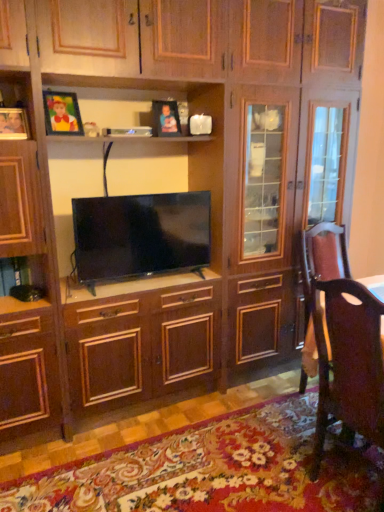
Where is `vacant space to the left of brown leather chair at lower right`? vacant space to the left of brown leather chair at lower right is located at coordinates (256, 477).